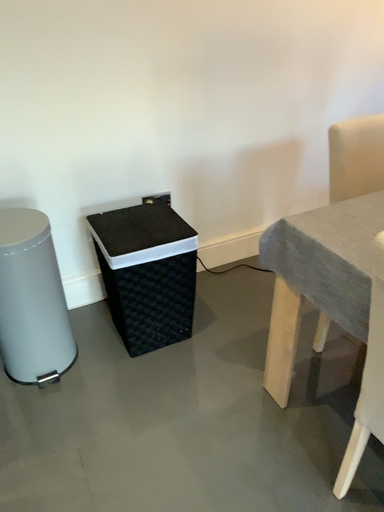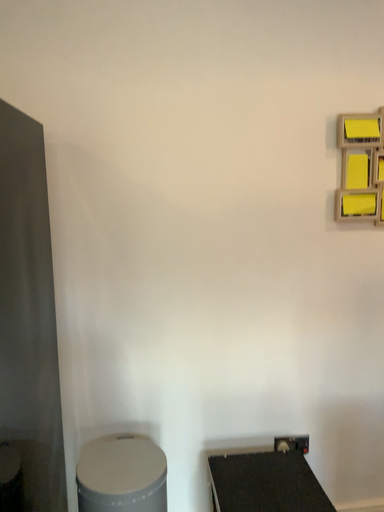
Question: Which way did the camera rotate in the video?

Choices:
 (A) rotated downward
 (B) rotated upward

Answer: (B)